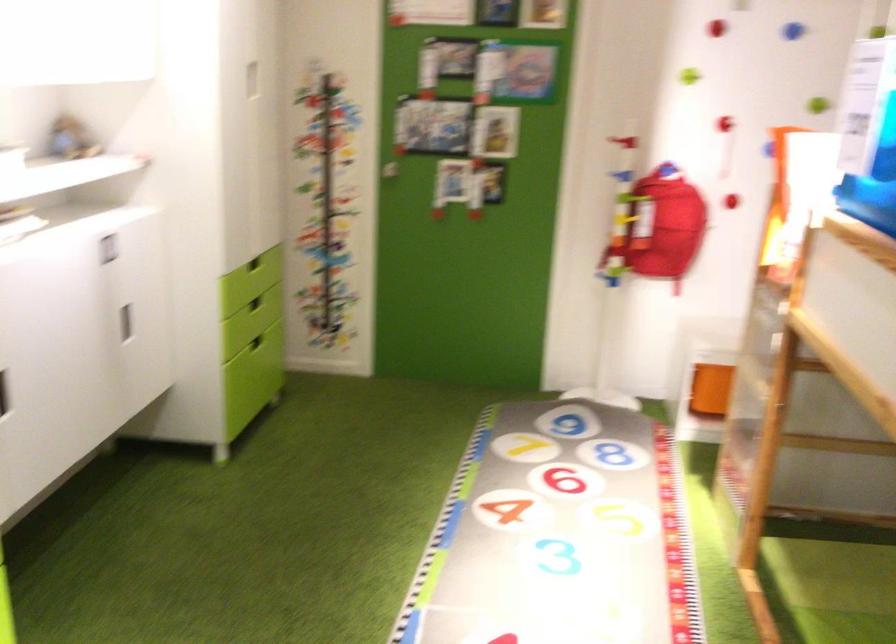
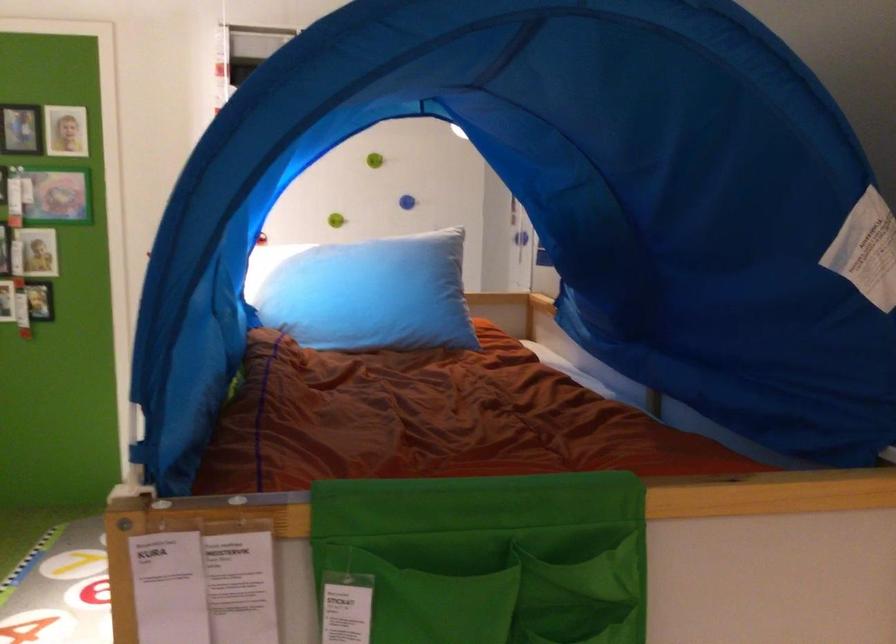
Question: I am providing you with two images of the same scene from different viewpoints. Which of the following objects are not visible in image2?

Choices:
 (A) red backpack
 (B) green wall knob
 (C) blue wall knob
 (D) green thumbtack

Answer: (A)